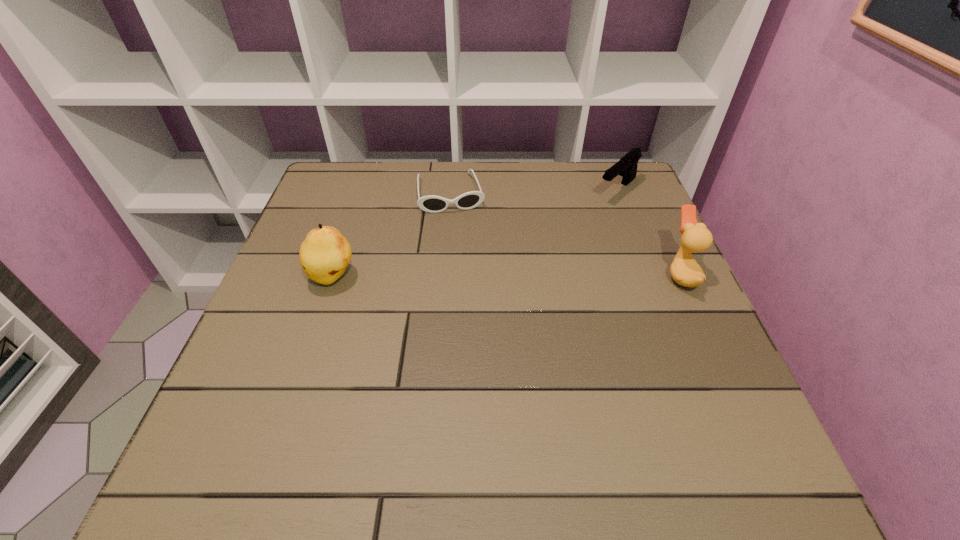
The height and width of the screenshot is (540, 960). Find the location of `vacant space on the desktop that is between the pear and the duck and is positioned on the front-facing side of the second shortest object`. vacant space on the desktop that is between the pear and the duck and is positioned on the front-facing side of the second shortest object is located at coordinates (517, 275).

Image resolution: width=960 pixels, height=540 pixels. In order to click on vacant space on the desktop that is between the pear and the duck and is positioned with the lenses of the sunglasses facing outward in this screenshot , I will do `click(469, 276)`.